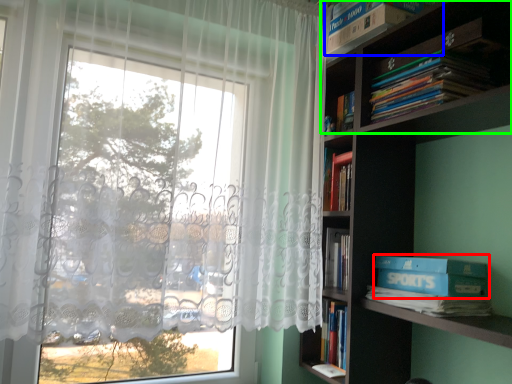
Question: Estimate the real-world distances between objects in this image. Which object is closer to paperback book (highlighted by a red box), book (highlighted by a blue box) or shelf (highlighted by a green box)?

Choices:
 (A) book
 (B) shelf

Answer: (B)